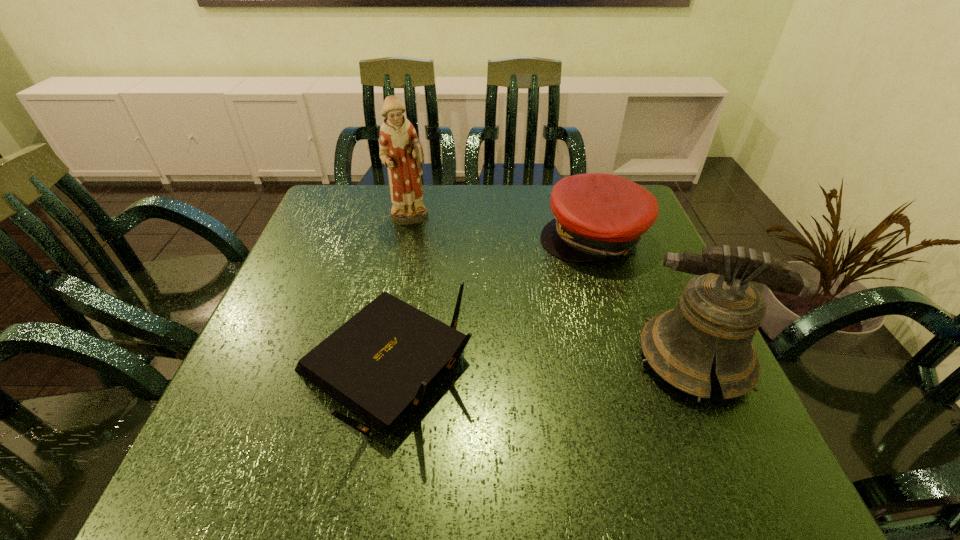
At what (x,y) coordinates should I click in order to perform the action: click on object at the far right corner. Please return your answer as a coordinate pair (x, y). This screenshot has width=960, height=540. Looking at the image, I should click on (596, 215).

Identify the location of object that is at the near right corner. This screenshot has height=540, width=960. (719, 312).

Locate an element on the screen. The width and height of the screenshot is (960, 540). vacant space at the far edge of the desktop is located at coordinates (465, 199).

Where is `vacant space at the left edge`? This screenshot has height=540, width=960. vacant space at the left edge is located at coordinates (333, 246).

In order to click on blank space at the far left corner in this screenshot , I will do `click(345, 195)`.

This screenshot has width=960, height=540. In the image, there is a desktop. In order to click on free space at the near right corner in this screenshot , I will do `click(725, 426)`.

Locate an element on the screen. This screenshot has height=540, width=960. unoccupied position between the router and the figurine is located at coordinates (397, 293).

You are a GUI agent. You are given a task and a screenshot of the screen. Output one action in this format:
    pyautogui.click(x=<x>, y=<y>)
    Task: Click on the free space between the cap and the bell
    This screenshot has height=540, width=960.
    Given the screenshot: What is the action you would take?
    pyautogui.click(x=644, y=298)

The width and height of the screenshot is (960, 540). Find the location of `free space between the router and the tallest object`. free space between the router and the tallest object is located at coordinates (397, 293).

You are a GUI agent. You are given a task and a screenshot of the screen. Output one action in this format:
    pyautogui.click(x=<x>, y=<y>)
    Task: Click on the vacant point located between the router and the second tallest object
    
    Given the screenshot: What is the action you would take?
    tap(540, 364)